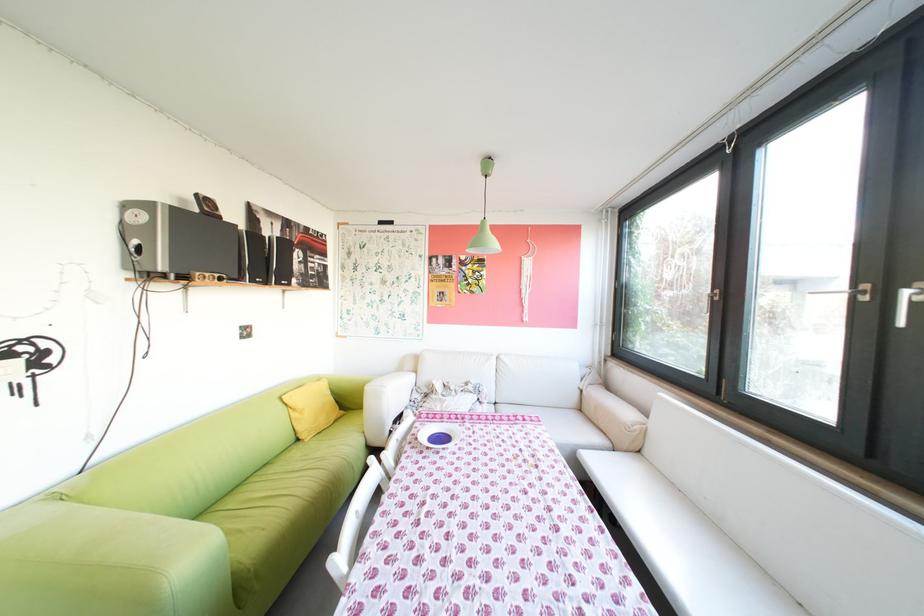
Locate an element on the screen. This screenshot has height=616, width=924. white sofa armrest is located at coordinates (385, 402).